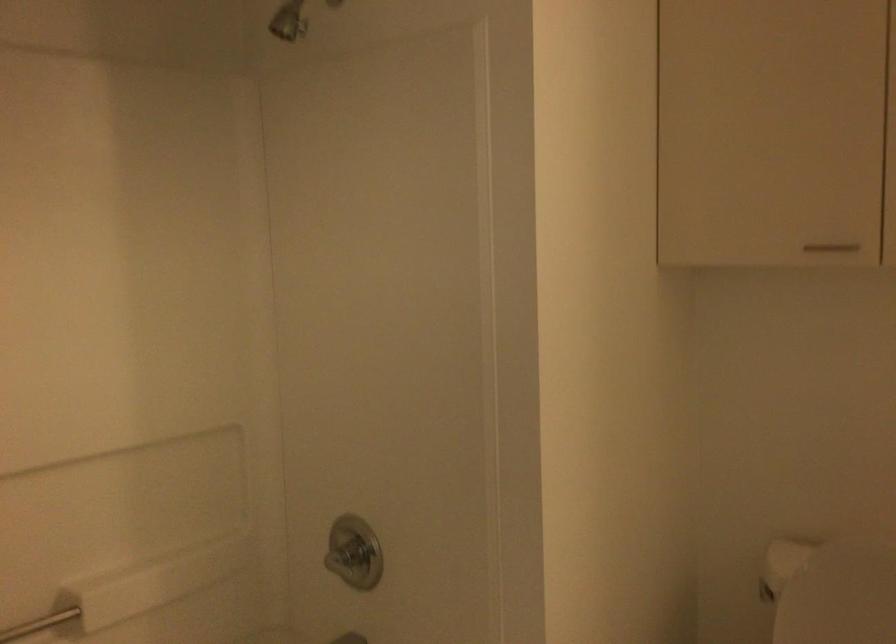
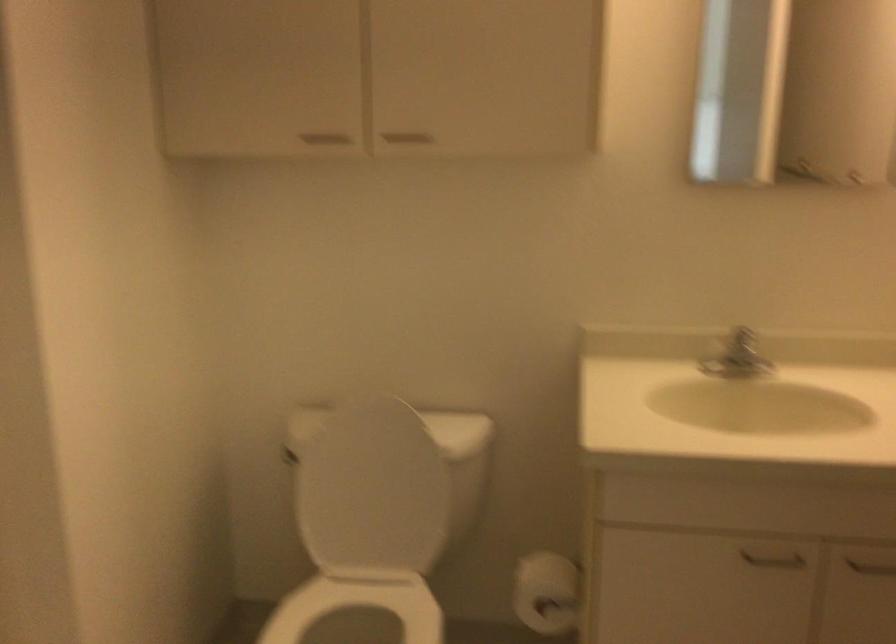
Question: The camera is either moving clockwise (left) or counter-clockwise (right) around the object. The first image is from the beginning of the video and the second image is from the end. Is the camera moving left or right when shooting the video?

Choices:
 (A) Left
 (B) Right

Answer: (A)